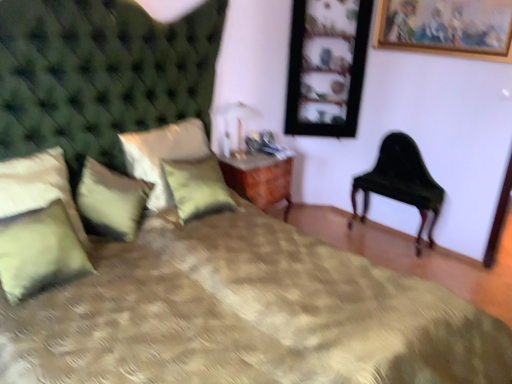
Where is `vacant area on top of wooden nightstand at center (from a real-world perspective)`? vacant area on top of wooden nightstand at center (from a real-world perspective) is located at coordinates (263, 155).